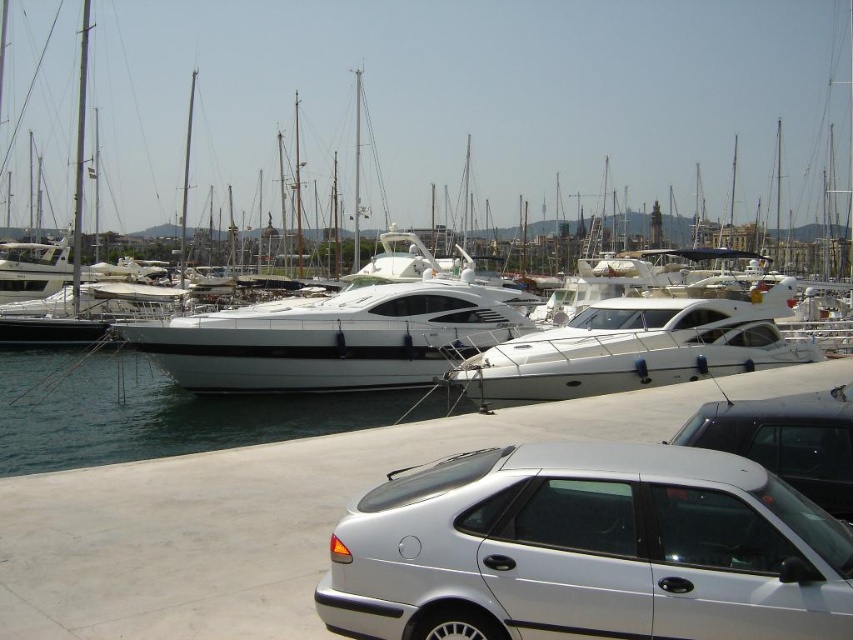
Can you confirm if white glossy yacht at center is bigger than satin silver sedan at lower right?

Correct, white glossy yacht at center is larger in size than satin silver sedan at lower right.

Which is behind, point (412, 33) or point (849, 428)?

Point (412, 33)

What do you see at coordinates (469, 100) in the screenshot?
I see `white glossy yacht at center` at bounding box center [469, 100].

Where is `white glossy yacht at center`? The width and height of the screenshot is (853, 640). white glossy yacht at center is located at coordinates (469, 100).

Does silver metallic car at lower right appear over white glossy water at center?

Yes, silver metallic car at lower right is above white glossy water at center.

Which is more to the right, silver metallic car at lower right or white glossy water at center?

From the viewer's perspective, silver metallic car at lower right appears more on the right side.

Who is more forward, [431,504] or [49,394]?

Point [431,504] is more forward.

Where is `silver metallic car at lower right`? The width and height of the screenshot is (853, 640). silver metallic car at lower right is located at coordinates (587, 548).

Is point (519, 628) positioned behind point (799, 417)?

No.

Is silver metallic car at lower right further to camera compared to satin silver sedan at lower right?

No, it is in front of satin silver sedan at lower right.

I want to click on silver metallic car at lower right, so click(x=587, y=548).